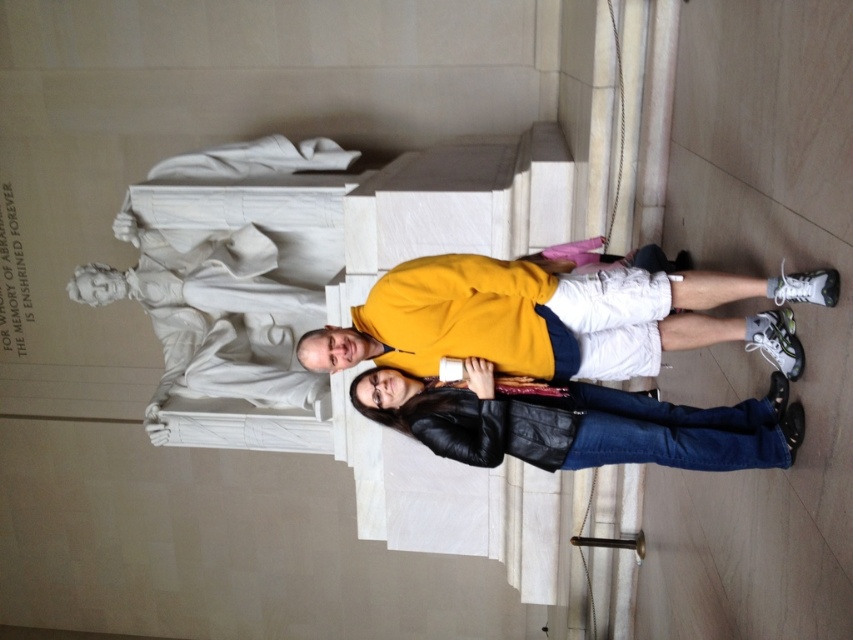
You are a photographer trying to capture a clear shot of the Lincoln Memorial statue. You notice two people in the foreground wearing a yellow matte sweatshirt at center and a black leather jacket at center. Which clothing item should you avoid focusing on to ensure the statue remains the main subject?

The yellow matte sweatshirt at center is larger in size than the black leather jacket at center, so focusing on the smaller black leather jacket at center would help keep the statue as the main subject.

You are a photographer trying to capture the Lincoln Memorial statue and the two people in front of it. You notice the yellow matte sweatshirt at center and the black leather jacket at center. Which clothing item is positioned higher in the photo?

The yellow matte sweatshirt at center is located above the black leather jacket at center, so it is positioned higher in the photo.